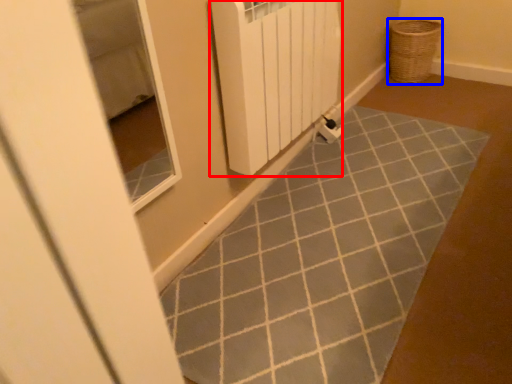
Question: Which object appears farthest to the camera in this image, radiator (highlighted by a red box) or basket (highlighted by a blue box)?

Choices:
 (A) radiator
 (B) basket

Answer: (B)